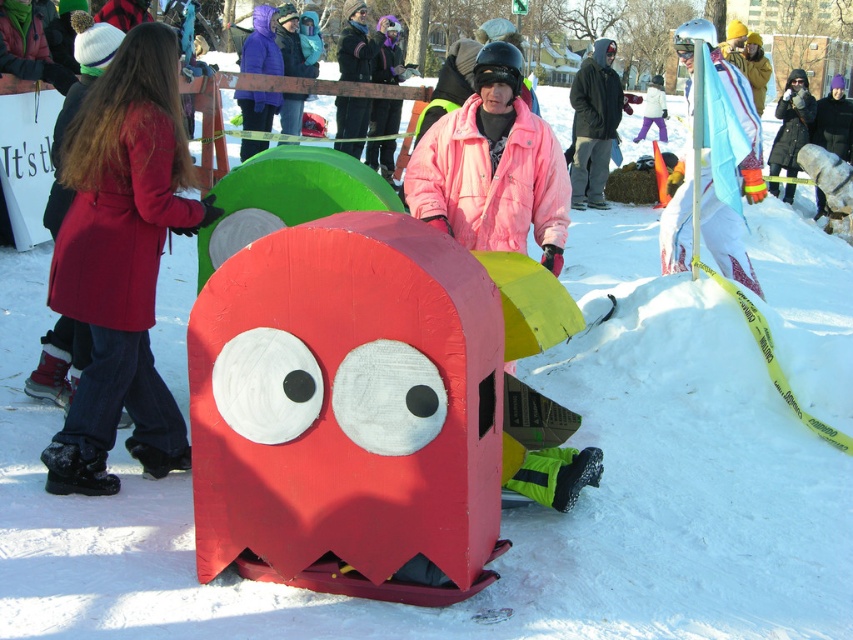
You are standing at the center of the winter scene and see the point labeled as point (120,260). What object is located at that point?

The point (120,260) corresponds to the matte red coat at left.

You are a photographer trying to capture a photo of the Pac Man sculpture. You have two jackets in your viewfinder, the matte red coat at left and dark gray hooded jacket at center. Which jacket should you avoid to keep the sculpture as the main focus?

The matte red coat at left is smaller than the dark gray hooded jacket at center, so the dark gray hooded jacket at center is larger and more likely to distract from the Pac Man sculpture. Avoid including the dark gray hooded jacket at center to keep the sculpture as the main focus.